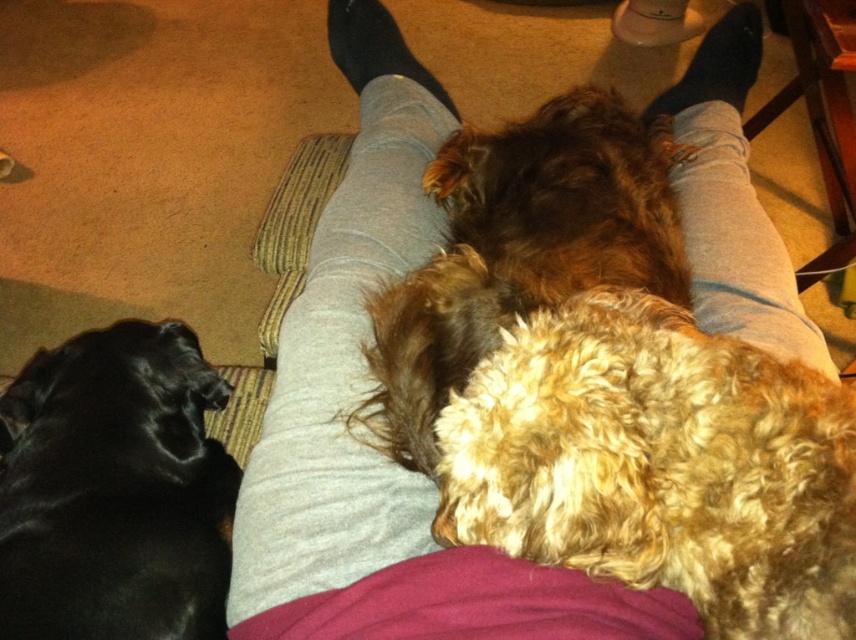
Question: Among these objects, which one is nearest to the camera?

Choices:
 (A) black fur at lower left
 (B) curly brown fur at center

Answer: (B)

Question: Observing the image, what is the correct spatial positioning of curly brown fur at center in reference to black fur at lower left?

Choices:
 (A) below
 (B) above

Answer: (B)

Question: Which of the following is the closest to the observer?

Choices:
 (A) (205, 637)
 (B) (568, 212)

Answer: (A)

Question: Can you confirm if curly brown fur at center is wider than black fur at lower left?

Choices:
 (A) no
 (B) yes

Answer: (B)

Question: Can you confirm if curly brown fur at center is positioned below black fur at lower left?

Choices:
 (A) yes
 (B) no

Answer: (B)